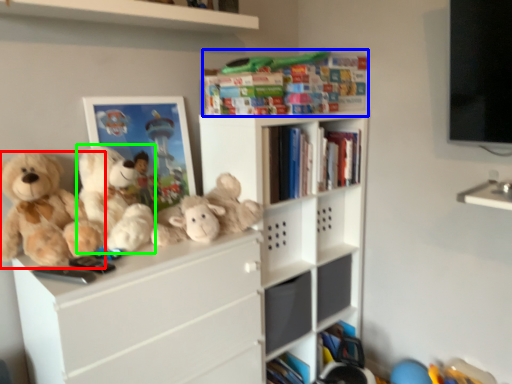
Question: Estimate the real-world distances between objects in this image. Which object is farther from teddy bear (highlighted by a red box), book (highlighted by a blue box) or teddy bear (highlighted by a green box)?

Choices:
 (A) book
 (B) teddy bear

Answer: (A)